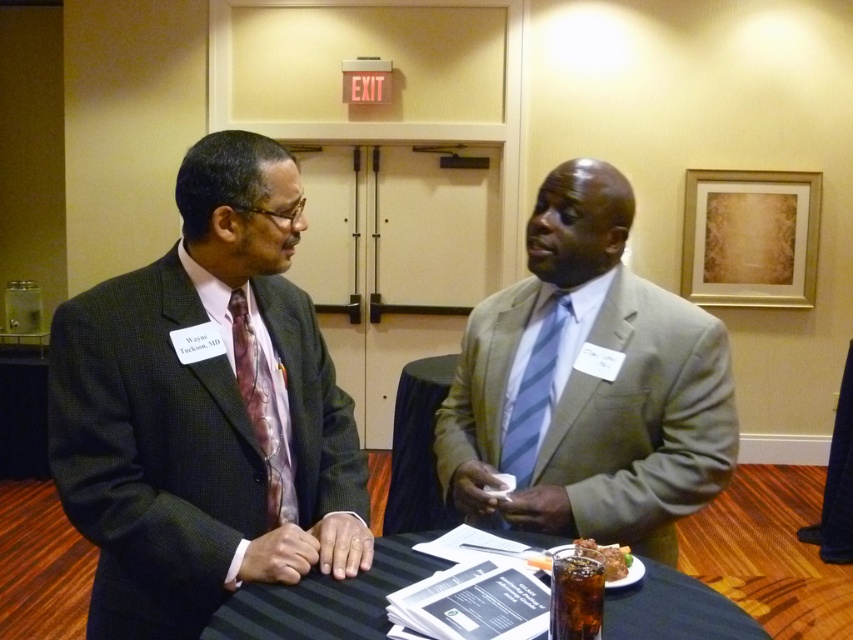
Question: Among these points, which one is farthest from the camera?

Choices:
 (A) (160, 385)
 (B) (714, 317)
 (C) (694, 586)

Answer: (B)

Question: Does black fabric table at center lie in front of brown crispy chicken at center?

Choices:
 (A) no
 (B) yes

Answer: (A)

Question: Does light gray suit at center have a lesser width compared to black fabric table at center?

Choices:
 (A) no
 (B) yes

Answer: (B)

Question: Which of the following is the closest to the observer?

Choices:
 (A) light gray suit at center
 (B) black fabric table at center
 (C) brown crispy chicken at center
 (D) matte black suit at left

Answer: (C)

Question: Can you confirm if black fabric table at center is smaller than brown crispy chicken at center?

Choices:
 (A) no
 (B) yes

Answer: (A)

Question: Among these points, which one is nearest to the camera?

Choices:
 (A) (469, 435)
 (B) (229, 234)
 (C) (746, 625)

Answer: (C)